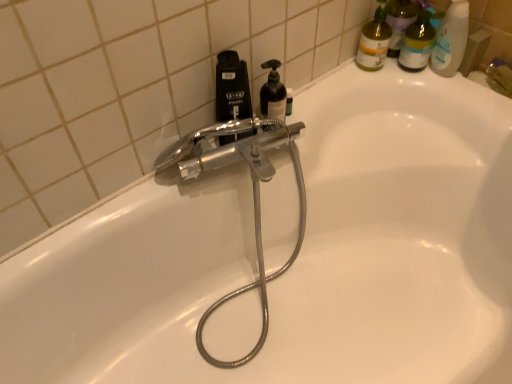
Question: From a real-world perspective, is matte yellow bottle at upper right on top of black matte soap dispenser at upper center?

Choices:
 (A) yes
 (B) no

Answer: (B)

Question: Considering the relative sizes of matte yellow bottle at upper right and black matte soap dispenser at upper center in the image provided, is matte yellow bottle at upper right bigger than black matte soap dispenser at upper center?

Choices:
 (A) yes
 (B) no

Answer: (B)

Question: Is matte yellow bottle at upper right smaller than black matte soap dispenser at upper center?

Choices:
 (A) no
 (B) yes

Answer: (B)

Question: Is matte yellow bottle at upper right not close to black matte soap dispenser at upper center?

Choices:
 (A) yes
 (B) no

Answer: (B)

Question: From the image's perspective, does matte yellow bottle at upper right appear higher than black matte soap dispenser at upper center?

Choices:
 (A) yes
 (B) no

Answer: (A)

Question: Is matte yellow bottle at upper right positioned with its back to black matte soap dispenser at upper center?

Choices:
 (A) yes
 (B) no

Answer: (B)

Question: Considering the relative positions of black matte soap dispenser at upper center and black matte soap dispenser at upper center in the image provided, is black matte soap dispenser at upper center behind black matte soap dispenser at upper center?

Choices:
 (A) yes
 (B) no

Answer: (A)

Question: Considering the relative sizes of black matte soap dispenser at upper center and black matte soap dispenser at upper center in the image provided, is black matte soap dispenser at upper center taller than black matte soap dispenser at upper center?

Choices:
 (A) yes
 (B) no

Answer: (B)

Question: Can you confirm if black matte soap dispenser at upper center is wider than black matte soap dispenser at upper center?

Choices:
 (A) no
 (B) yes

Answer: (A)

Question: Are black matte soap dispenser at upper center and black matte soap dispenser at upper center located far from each other?

Choices:
 (A) yes
 (B) no

Answer: (B)

Question: Is black matte soap dispenser at upper center outside of black matte soap dispenser at upper center?

Choices:
 (A) yes
 (B) no

Answer: (A)

Question: From a real-world perspective, is black matte soap dispenser at upper center located higher than black matte soap dispenser at upper center?

Choices:
 (A) no
 (B) yes

Answer: (A)

Question: From a real-world perspective, does black matte soap dispenser at upper center sit lower than translucent plastic bottles at upper right?

Choices:
 (A) yes
 (B) no

Answer: (B)